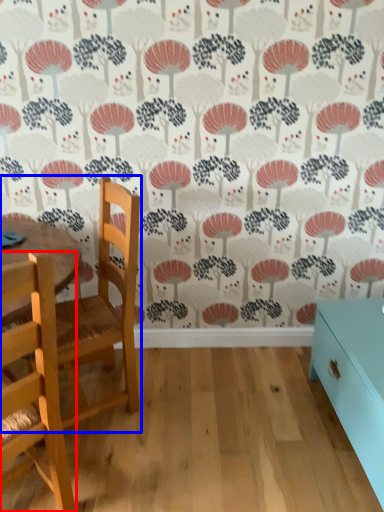
Question: Which object is further to the camera taking this photo, chair (highlighted by a red box) or chair (highlighted by a blue box)?

Choices:
 (A) chair
 (B) chair

Answer: (B)